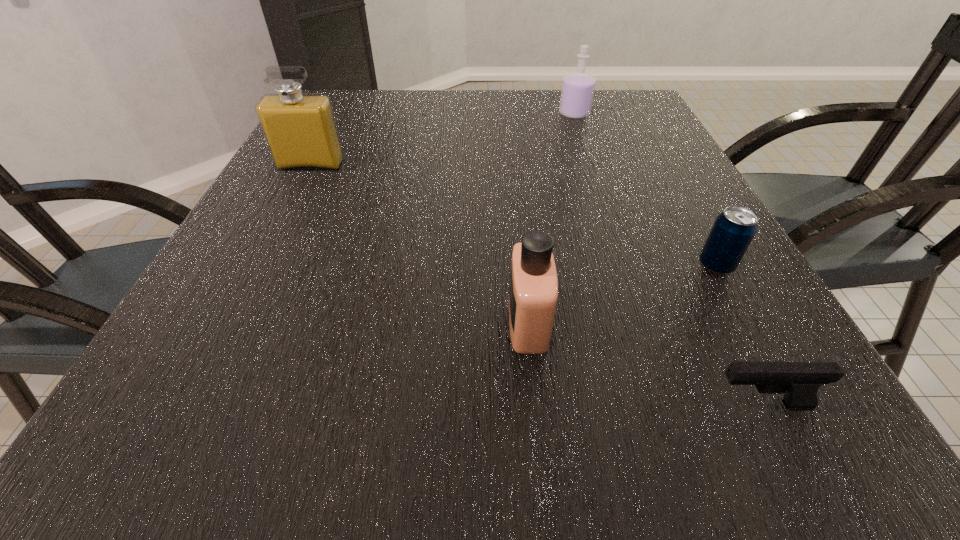
Find the location of a particular element. Image resolution: width=960 pixels, height=540 pixels. vacant space at the far right corner is located at coordinates (614, 124).

The image size is (960, 540). What are the coordinates of `empty space between the second farthest perfume and the third nearest object` in the screenshot? It's located at (514, 215).

In order to click on vacant area between the tallest object and the rightmost perfume in this screenshot , I will do `click(443, 140)`.

The width and height of the screenshot is (960, 540). I want to click on free space between the fourth farthest object and the third farthest object, so click(622, 294).

Where is `empty space that is in between the fourth object from right to left and the tallest object`? Image resolution: width=960 pixels, height=540 pixels. empty space that is in between the fourth object from right to left and the tallest object is located at coordinates (420, 244).

The width and height of the screenshot is (960, 540). In order to click on free area in between the second shortest object and the pistol in this screenshot , I will do `click(737, 335)`.

The height and width of the screenshot is (540, 960). Identify the location of free space between the fourth object from right to left and the pistol. click(643, 364).

Find the location of a particular element. The width and height of the screenshot is (960, 540). free space that is in between the fourth tallest object and the pistol is located at coordinates (737, 335).

The width and height of the screenshot is (960, 540). Identify the location of vacant point located between the second farthest object and the farthest perfume. (443, 140).

Where is `vacant area that lies between the nearest perfume and the third object from left to right`? The image size is (960, 540). vacant area that lies between the nearest perfume and the third object from left to right is located at coordinates (551, 218).